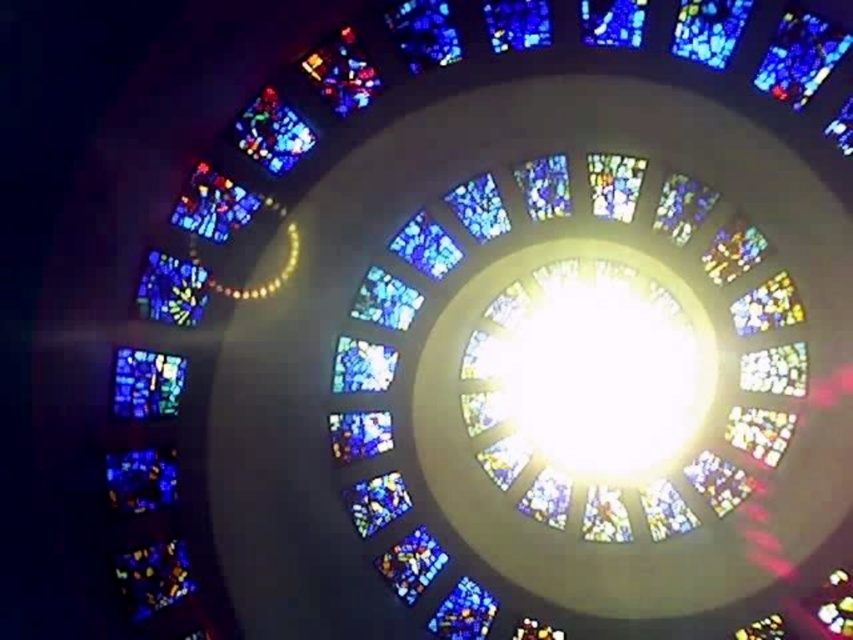
Question: Can you confirm if multicolored stained glass at center is positioned to the right of multicolored stained glass window at upper left?

Choices:
 (A) no
 (B) yes

Answer: (B)

Question: Considering the relative positions of multicolored stained glass at center and transparent glass dome at center in the image provided, where is multicolored stained glass at center located with respect to transparent glass dome at center?

Choices:
 (A) right
 (B) left

Answer: (B)

Question: Considering the relative positions of multicolored stained glass at lower left and multicolored stained glass window at upper left in the image provided, where is multicolored stained glass at lower left located with respect to multicolored stained glass window at upper left?

Choices:
 (A) above
 (B) below

Answer: (B)

Question: Which object is farther from the camera taking this photo?

Choices:
 (A) multicolored stained glass at lower left
 (B) transparent glass dome at center
 (C) multicolored stained glass window at upper left

Answer: (B)

Question: Which object is positioned closest to the multicolored stained glass at center?

Choices:
 (A) transparent glass dome at center
 (B) multicolored stained glass window at upper left

Answer: (A)

Question: Considering the real-world distances, which object is closest to the multicolored stained glass at lower left?

Choices:
 (A) transparent glass dome at center
 (B) multicolored stained glass at center

Answer: (B)